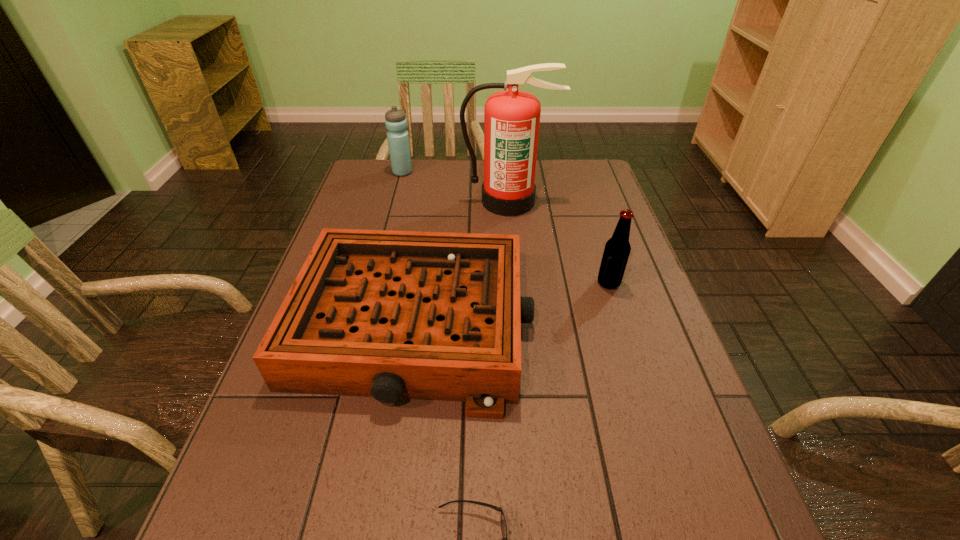
Image resolution: width=960 pixels, height=540 pixels. In order to click on water bottle present at the far edge in this screenshot , I will do `click(395, 120)`.

This screenshot has width=960, height=540. I want to click on water bottle that is at the left edge, so click(395, 120).

The height and width of the screenshot is (540, 960). Identify the location of gameboard that is at the left edge. (392, 315).

This screenshot has height=540, width=960. Find the location of `object at the right edge`. object at the right edge is located at coordinates tap(617, 249).

Where is `object present at the far left corner`? This screenshot has height=540, width=960. object present at the far left corner is located at coordinates (395, 120).

At what (x,y) coordinates should I click in order to perform the action: click on vacant space at the far edge. Please return your answer as a coordinate pair (x, y). This screenshot has height=540, width=960. Looking at the image, I should click on (454, 192).

You are a GUI agent. You are given a task and a screenshot of the screen. Output one action in this format:
    pyautogui.click(x=<x>, y=<y>)
    Task: Click on the vacant area at the left edge of the desktop
    
    Given the screenshot: What is the action you would take?
    pyautogui.click(x=322, y=470)

This screenshot has height=540, width=960. In order to click on vacant region at the right edge in this screenshot , I will do `click(594, 278)`.

In the image, there is a desktop. Where is `vacant space at the far right corner`? Image resolution: width=960 pixels, height=540 pixels. vacant space at the far right corner is located at coordinates (561, 187).

Where is `vacant point located between the fire extinguisher and the farthest object`? The width and height of the screenshot is (960, 540). vacant point located between the fire extinguisher and the farthest object is located at coordinates (456, 187).